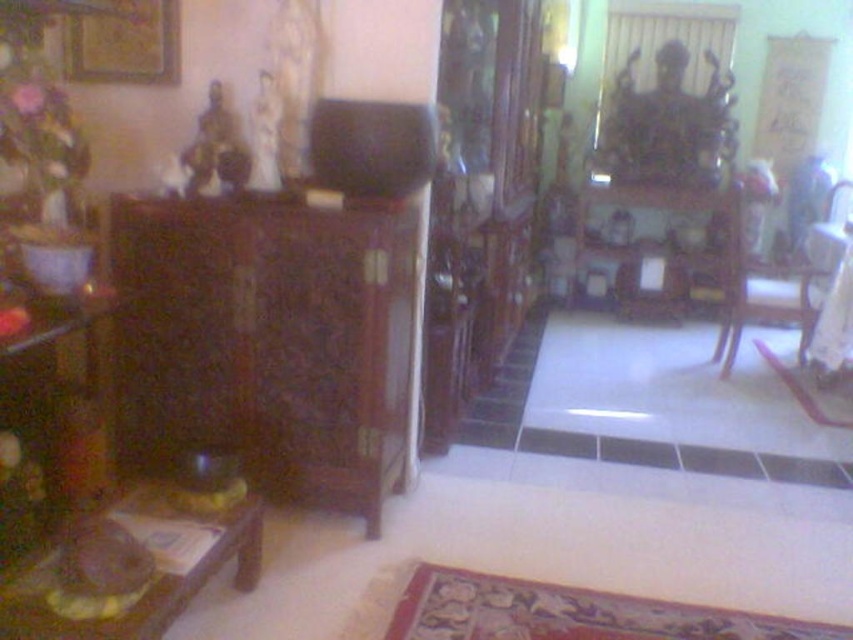
Question: Is wooden picture frame at upper left above wooden armchair at center?

Choices:
 (A) yes
 (B) no

Answer: (A)

Question: Which object is the closest to the wooden picture frame at upper left?

Choices:
 (A) dark wood dresser at left
 (B) wooden tray at lower left

Answer: (A)

Question: Which of the following is the closest to the observer?

Choices:
 (A) (189, 545)
 (B) (732, 288)

Answer: (A)

Question: Does dark wood dresser at left have a lesser width compared to wooden tray at lower left?

Choices:
 (A) no
 (B) yes

Answer: (A)

Question: Based on their relative distances, which object is farther from the wooden picture frame at upper left?

Choices:
 (A) wooden tray at lower left
 (B) dark wood dresser at left
 (C) wooden armchair at center

Answer: (C)

Question: Is wooden picture frame at upper left to the left of wooden armchair at center from the viewer's perspective?

Choices:
 (A) yes
 (B) no

Answer: (A)